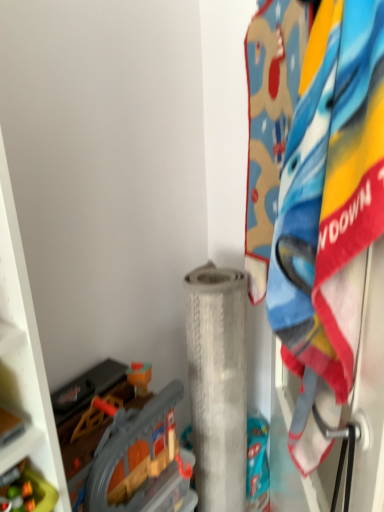
Question: Relative to plastic gray train set at lower left, which appears as the second toy when viewed from the front, is fluffy cotton towel at right in front or behind?

Choices:
 (A) front
 (B) behind

Answer: (A)

Question: Which is correct: fluffy cotton towel at right is inside plastic gray train set at lower left, which appears as the second toy when viewed from the front, or outside of it?

Choices:
 (A) outside
 (B) inside

Answer: (A)

Question: Which of these objects is positioned farthest from the translucent plastic toy at lower left, positioned as the first toy in front-to-back order?

Choices:
 (A) white textured roll at center
 (B) plastic gray train set at lower left, which appears as the 1th toy when viewed from the back
 (C) fluffy cotton towel at right

Answer: (C)

Question: Which is farther from the fluffy cotton towel at right?

Choices:
 (A) translucent plastic toy at lower left, which ranks as the second toy in back-to-front order
 (B) white textured roll at center
 (C) plastic gray train set at lower left, which appears as the 1th toy when viewed from the back

Answer: (A)